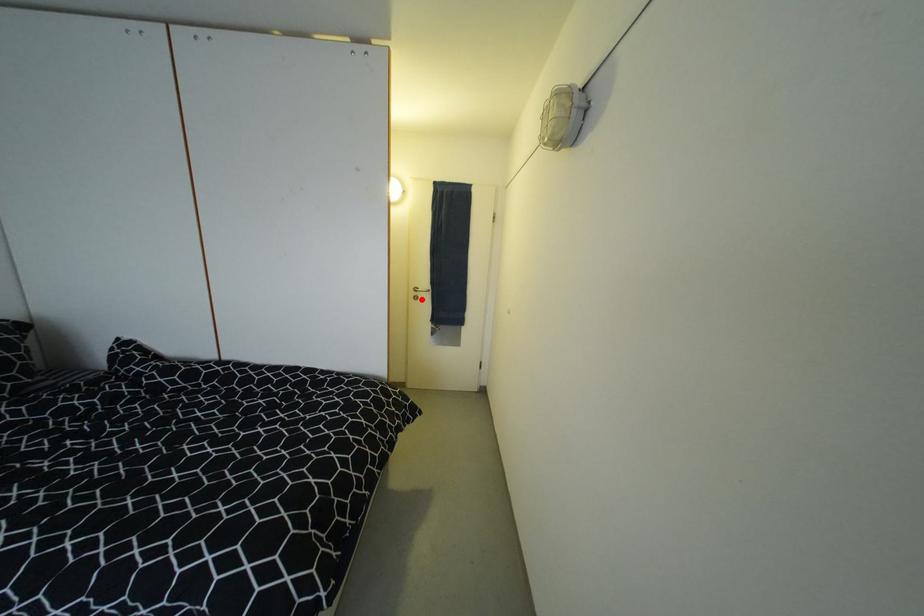
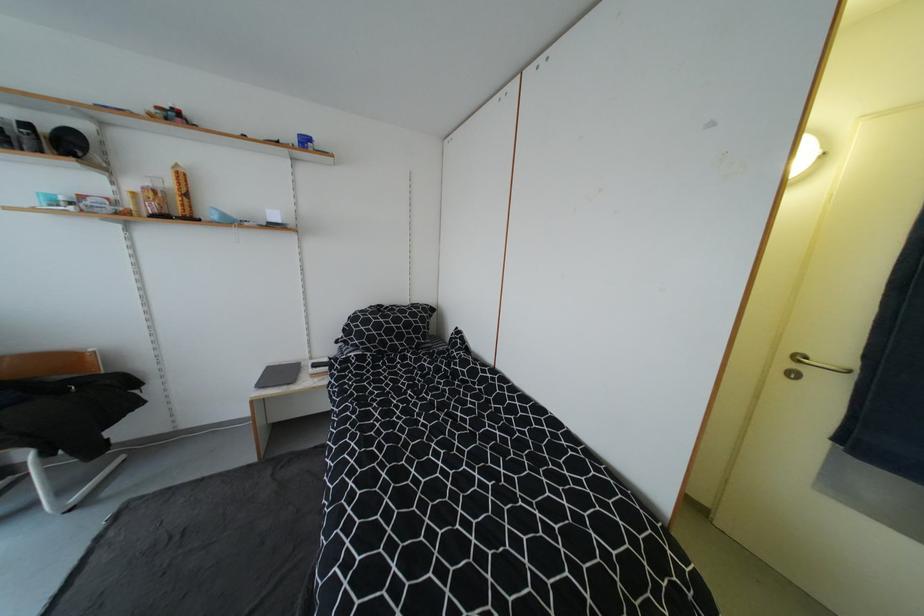
Find the pixel in the second image that matches the highlighted location in the first image.

(798, 376)